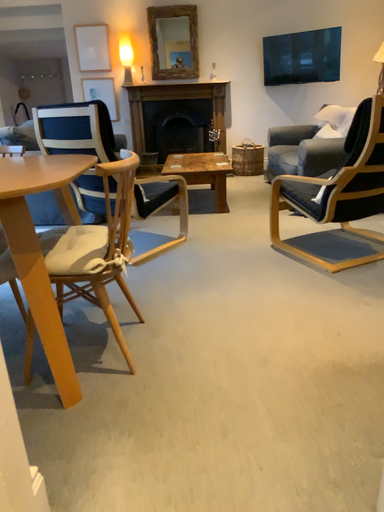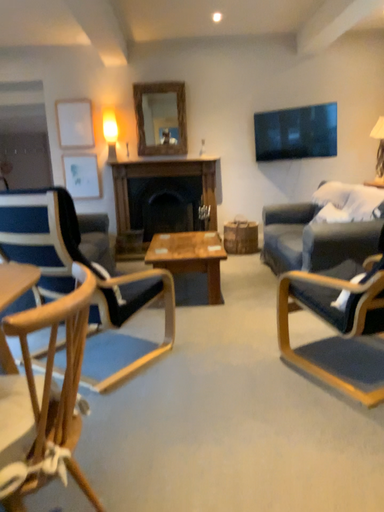
Question: How did the camera likely rotate when shooting the video?

Choices:
 (A) rotated downward
 (B) rotated upward

Answer: (B)